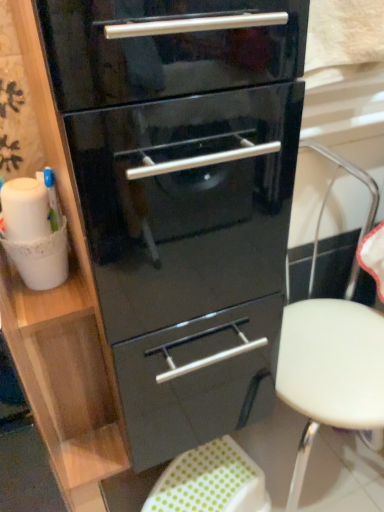
Question: Is white plastic stool at center not close to green polka dot fabric step stool at lower center?

Choices:
 (A) yes
 (B) no

Answer: (B)

Question: Would you say white plastic stool at center is outside green polka dot fabric step stool at lower center?

Choices:
 (A) yes
 (B) no

Answer: (A)

Question: Is green polka dot fabric step stool at lower center at the back of white plastic stool at center?

Choices:
 (A) no
 (B) yes

Answer: (A)

Question: Does white plastic stool at center have a lesser width compared to green polka dot fabric step stool at lower center?

Choices:
 (A) no
 (B) yes

Answer: (A)

Question: Is white plastic stool at center placed right next to green polka dot fabric step stool at lower center?

Choices:
 (A) yes
 (B) no

Answer: (B)

Question: Does white plastic stool at center have a lesser height compared to green polka dot fabric step stool at lower center?

Choices:
 (A) no
 (B) yes

Answer: (A)

Question: From the image's perspective, is white plastic stool at center beneath glossy black chest of drawers at center?

Choices:
 (A) no
 (B) yes

Answer: (B)

Question: From the image's perspective, would you say white plastic stool at center is positioned over glossy black chest of drawers at center?

Choices:
 (A) yes
 (B) no

Answer: (B)

Question: Can you confirm if white plastic stool at center is shorter than glossy black chest of drawers at center?

Choices:
 (A) no
 (B) yes

Answer: (B)

Question: Is glossy black chest of drawers at center completely or partially inside white plastic stool at center?

Choices:
 (A) no
 (B) yes

Answer: (A)

Question: Can we say white plastic stool at center lies outside glossy black chest of drawers at center?

Choices:
 (A) yes
 (B) no

Answer: (A)

Question: Is white plastic stool at center oriented away from glossy black chest of drawers at center?

Choices:
 (A) yes
 (B) no

Answer: (B)

Question: Is green polka dot fabric step stool at lower center smaller than glossy black chest of drawers at center?

Choices:
 (A) yes
 (B) no

Answer: (A)